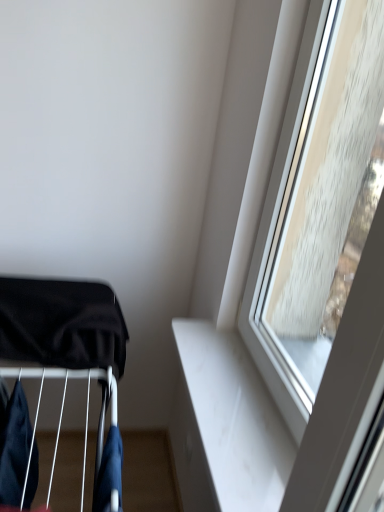
Find the location of a particular element. The image size is (384, 512). black fabric baby carriage at lower left is located at coordinates (60, 376).

Describe the element at coordinates (60, 376) in the screenshot. I see `black fabric baby carriage at lower left` at that location.

Find the location of `black fabric baby carriage at lower left`. black fabric baby carriage at lower left is located at coordinates (60, 376).